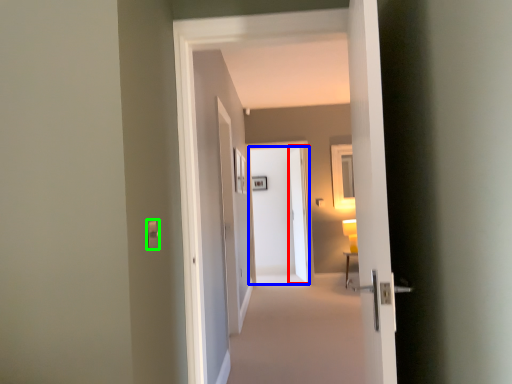
Question: Which object is positioned farthest from screen door (highlighted by a red box)? Select from door (highlighted by a blue box) and light switch (highlighted by a green box).

Choices:
 (A) door
 (B) light switch

Answer: (B)